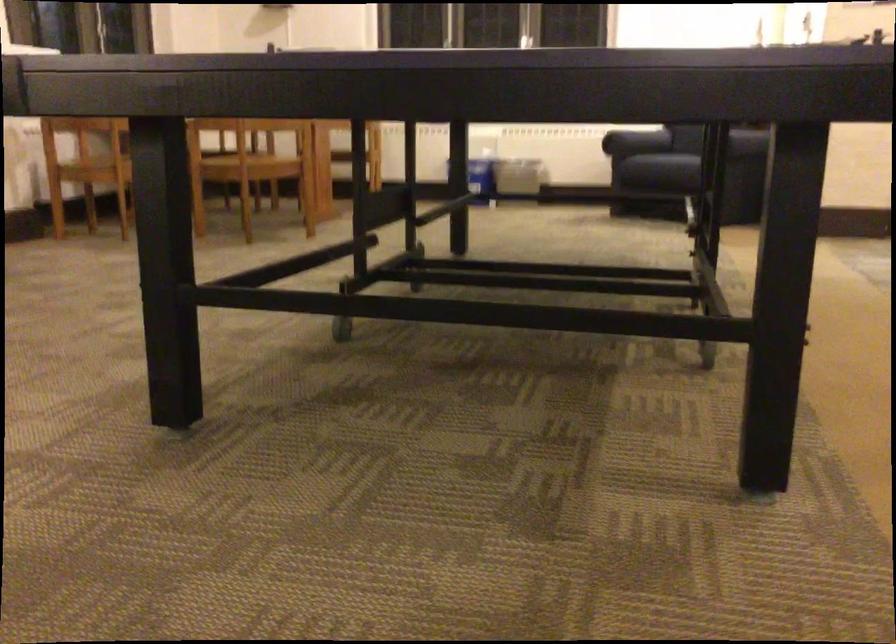
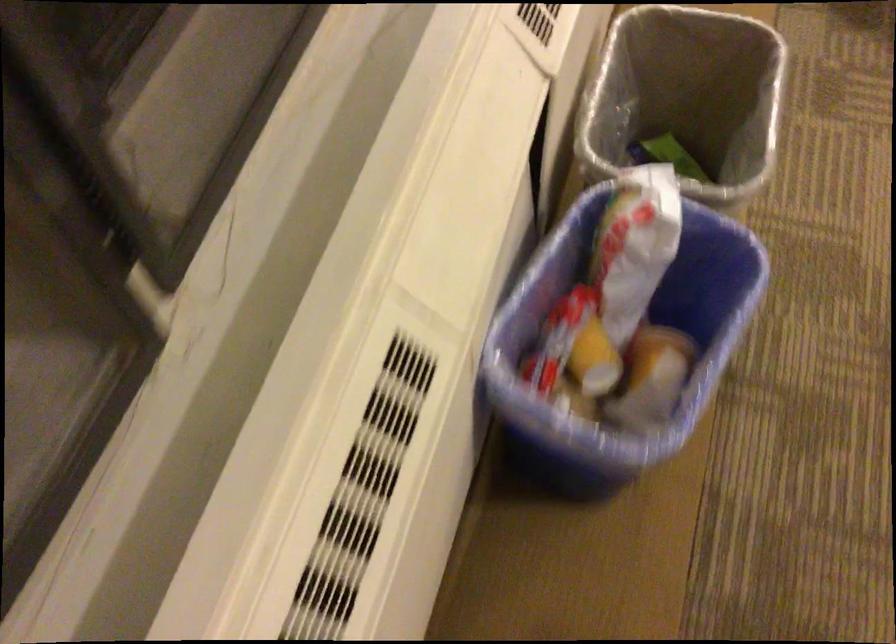
The point at [549,176] is marked in the first image. Where is the corresponding point in the second image?

(686, 97)